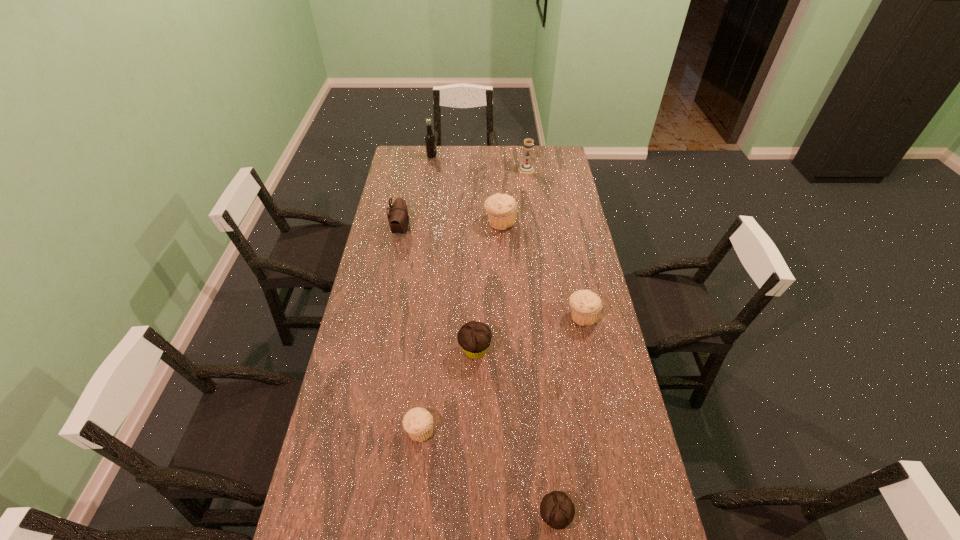
Image resolution: width=960 pixels, height=540 pixels. Find the location of `free spot that satisfies the following two spatial constraints: 1. on the label of the fifth farthest object; 2. on the left side of the farthest object`. free spot that satisfies the following two spatial constraints: 1. on the label of the fifth farthest object; 2. on the left side of the farthest object is located at coordinates (409, 316).